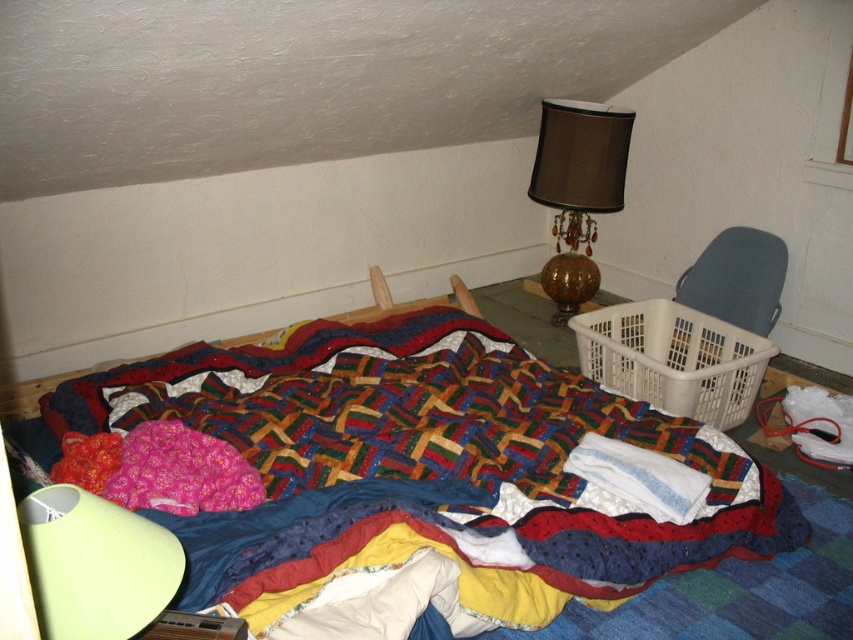
Is multicolored quilt at center bigger than gray plastic laundry basket at right?

Yes.

Between multicolored quilt at center and gray plastic laundry basket at right, which one appears on the left side from the viewer's perspective?

multicolored quilt at center

This screenshot has height=640, width=853. What do you see at coordinates (426, 467) in the screenshot? I see `multicolored quilt at center` at bounding box center [426, 467].

Identify the location of multicolored quilt at center. The height and width of the screenshot is (640, 853). (426, 467).

From the picture: Can you confirm if beige plastic laundry basket at center-right is shorter than brown glossy lampshade at upper right?

Yes, beige plastic laundry basket at center-right is shorter than brown glossy lampshade at upper right.

Locate an element on the screen. beige plastic laundry basket at center-right is located at coordinates (672, 358).

Locate an element on the screen. This screenshot has width=853, height=640. beige plastic laundry basket at center-right is located at coordinates (672, 358).

How distant is beige plastic laundry basket at center-right from gray plastic laundry basket at right?

beige plastic laundry basket at center-right and gray plastic laundry basket at right are 16.31 inches apart from each other.

Does beige plastic laundry basket at center-right have a lesser width compared to gray plastic laundry basket at right?

In fact, beige plastic laundry basket at center-right might be wider than gray plastic laundry basket at right.

Is point (643, 300) positioned after point (741, 237)?

No, (643, 300) is in front of (741, 237).

Where is `beige plastic laundry basket at center-right`? The height and width of the screenshot is (640, 853). beige plastic laundry basket at center-right is located at coordinates (672, 358).